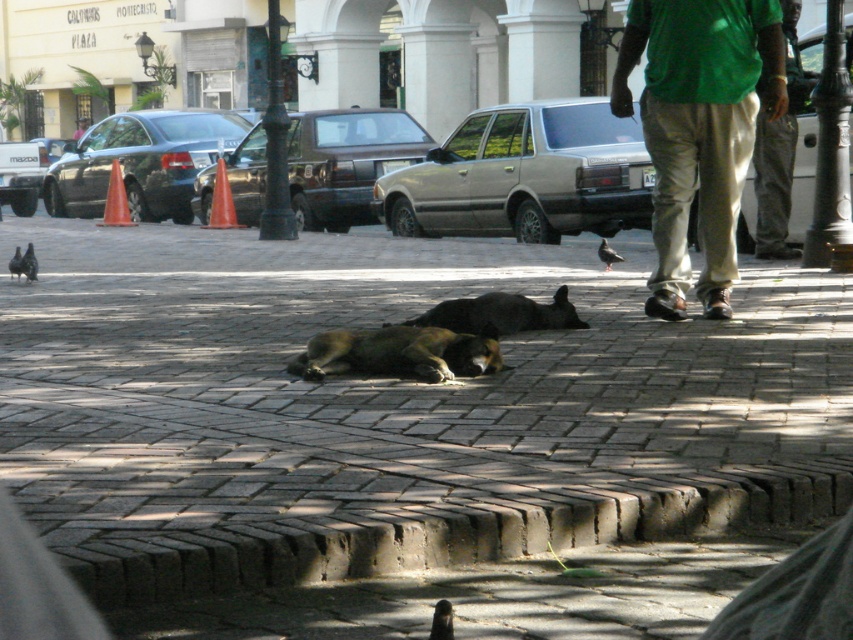
Question: Is green cotton shirt at right above dark brown metallic car at center?

Choices:
 (A) yes
 (B) no

Answer: (B)

Question: Which point is closer to the camera?

Choices:
 (A) (453, 636)
 (B) (604, 257)
 (C) (369, 371)

Answer: (A)

Question: Estimate the real-world distances between objects in this image. Which object is closer to the green cotton shirt at right?

Choices:
 (A) silver metallic sedan at center
 (B) black fur dog at center
 (C) dark brown metallic car at center

Answer: (B)

Question: Does brick pavement at center appear over gray matte pigeon at center?

Choices:
 (A) yes
 (B) no

Answer: (B)

Question: Is brick pavement at center positioned before brown fur dog at center?

Choices:
 (A) no
 (B) yes

Answer: (B)

Question: Based on their relative distances, which object is farther from the black fur dog at center?

Choices:
 (A) matte black car at left
 (B) gray matte pigeon at lower left
 (C) brick pavement at center
 (D) dark brown metallic car at center

Answer: (A)